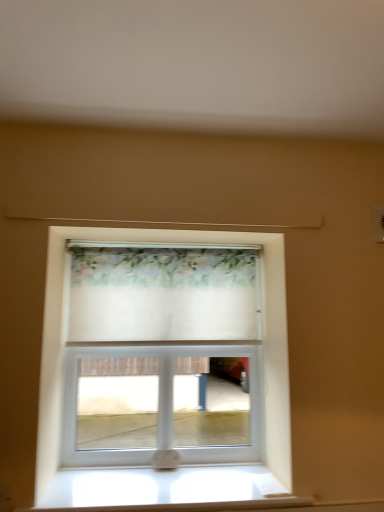
Question: Would you say floral sheer curtain at center contains white fabric at center?

Choices:
 (A) yes
 (B) no

Answer: (B)

Question: From the image's perspective, would you say floral sheer curtain at center is shown under white fabric at center?

Choices:
 (A) no
 (B) yes

Answer: (A)

Question: Does floral sheer curtain at center have a larger size compared to white fabric at center?

Choices:
 (A) no
 (B) yes

Answer: (A)

Question: Can you confirm if floral sheer curtain at center is positioned to the right of white fabric at center?

Choices:
 (A) no
 (B) yes

Answer: (B)

Question: Is the surface of floral sheer curtain at center in direct contact with white fabric at center?

Choices:
 (A) yes
 (B) no

Answer: (B)

Question: Can you confirm if floral sheer curtain at center is thinner than white fabric at center?

Choices:
 (A) yes
 (B) no

Answer: (A)

Question: Is floral sheer curtain at center a part of white fabric at center?

Choices:
 (A) yes
 (B) no

Answer: (B)

Question: Would you say white fabric at center is outside floral sheer curtain at center?

Choices:
 (A) no
 (B) yes

Answer: (B)

Question: Does white fabric at center come in front of floral sheer curtain at center?

Choices:
 (A) no
 (B) yes

Answer: (A)

Question: Is white fabric at center shorter than floral sheer curtain at center?

Choices:
 (A) no
 (B) yes

Answer: (A)

Question: Is white fabric at center directly adjacent to floral sheer curtain at center?

Choices:
 (A) yes
 (B) no

Answer: (B)

Question: Is white fabric at center looking in the opposite direction of floral sheer curtain at center?

Choices:
 (A) no
 (B) yes

Answer: (B)

Question: Does white wood window sill at lower center have a lesser height compared to floral sheer curtain at center?

Choices:
 (A) no
 (B) yes

Answer: (B)